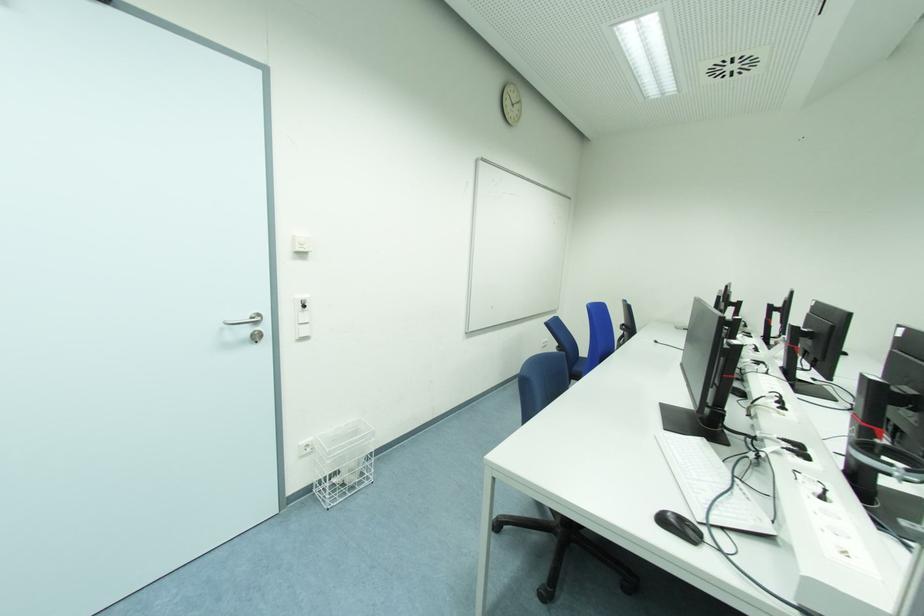
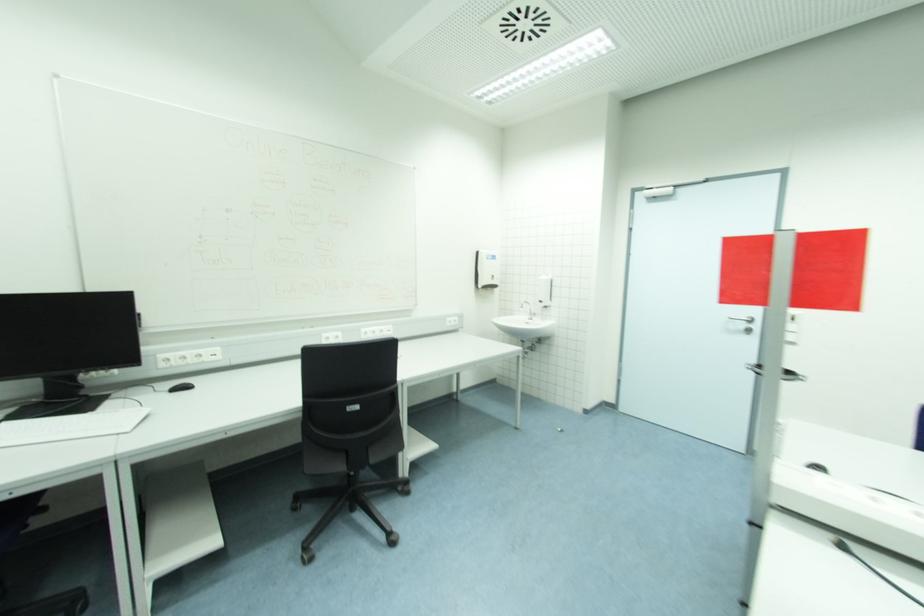
The point at (249, 333) is marked in the first image. Where is the corresponding point in the second image?

(746, 326)